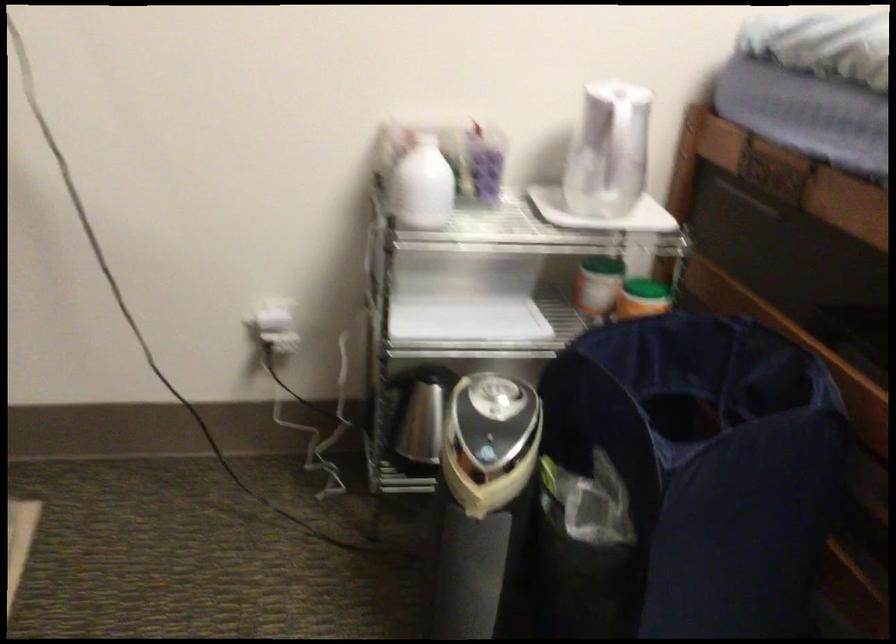
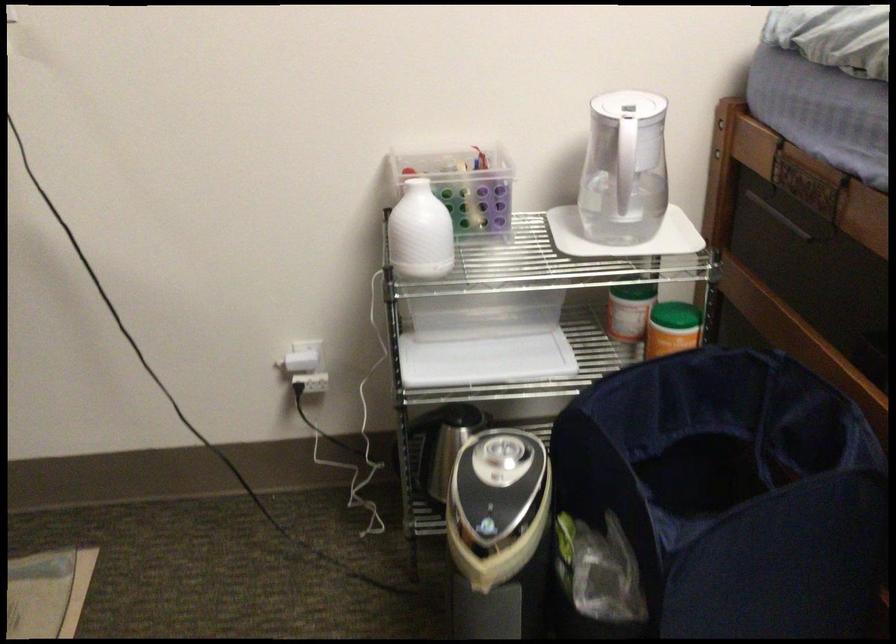
Find the pixel in the second image that matches point 606,301 in the first image.

(635, 325)